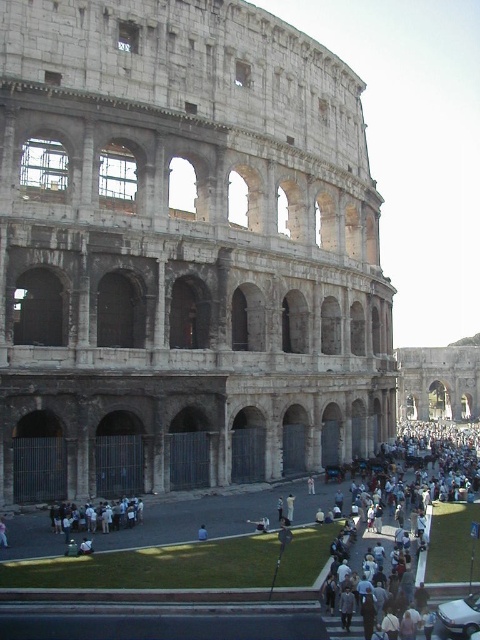
Can you confirm if white cotton crowd at lower right is positioned to the right of light blue fabric at lower center?

Indeed, white cotton crowd at lower right is positioned on the right side of light blue fabric at lower center.

Does white cotton crowd at lower right have a greater width compared to light blue fabric at lower center?

Yes.

Is point (472, 445) behind point (201, 531)?

Yes, it is.

This screenshot has width=480, height=640. Find the location of `white cotton crowd at lower right`. white cotton crowd at lower right is located at coordinates (430, 538).

What do you see at coordinates (182, 252) in the screenshot? The image size is (480, 640). I see `stone amphitheater at center` at bounding box center [182, 252].

Does stone amphitheater at center lie behind white cotton crowd at lower right?

Yes, it is.

Is point (23, 433) farther from viewer compared to point (381, 545)?

Yes, point (23, 433) is farther from viewer.

In order to click on stone amphitheater at center in this screenshot , I will do `click(182, 252)`.

Describe the element at coordinates (182, 252) in the screenshot. I see `stone amphitheater at center` at that location.

Is point (312, 401) positioned before point (200, 525)?

No.

At what (x,y) coordinates should I click in order to perform the action: click on stone amphitheater at center. Please return your answer as a coordinate pair (x, y). The image size is (480, 640). Looking at the image, I should click on coord(182,252).

What are the coordinates of `stone amphitheater at center` in the screenshot? It's located at (182, 252).